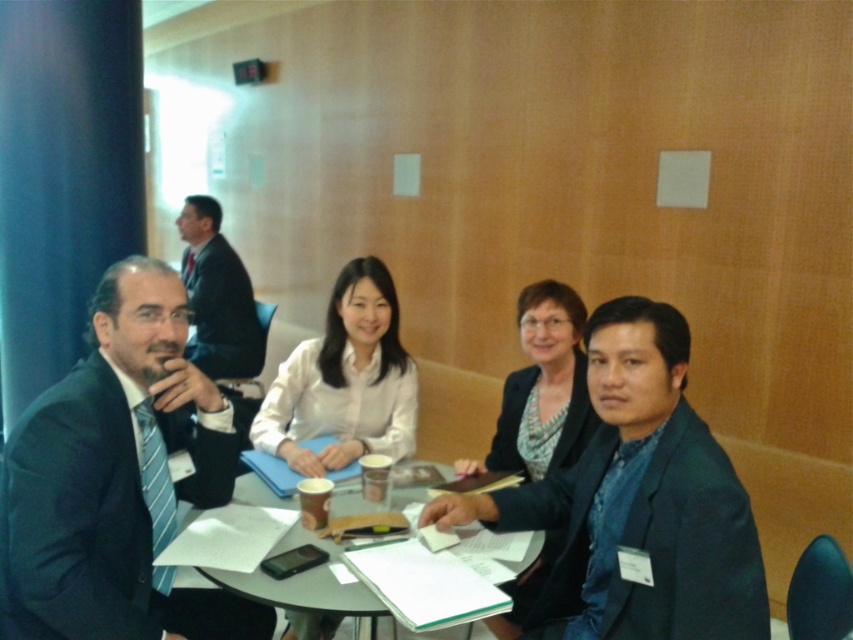
Does white matte shirt at center appear on the right side of matte black blazer at center?

No, white matte shirt at center is not to the right of matte black blazer at center.

The height and width of the screenshot is (640, 853). In order to click on white matte shirt at center in this screenshot , I will do `click(344, 380)`.

Who is more forward, (302, 396) or (543, 566)?

Point (543, 566) is more forward.

Image resolution: width=853 pixels, height=640 pixels. I want to click on white matte shirt at center, so click(x=344, y=380).

The height and width of the screenshot is (640, 853). In order to click on matte black suit at center in this screenshot , I will do `click(117, 481)`.

Identify the location of matte black suit at center. The width and height of the screenshot is (853, 640). (117, 481).

Is matte black blazer at center further to the viewer compared to dark suit at upper left?

No, it is in front of dark suit at upper left.

Can you confirm if matte black blazer at center is smaller than dark suit at upper left?

Indeed, matte black blazer at center has a smaller size compared to dark suit at upper left.

In order to click on matte black blazer at center in this screenshot , I will do `click(543, 388)`.

This screenshot has height=640, width=853. I want to click on matte black blazer at center, so click(543, 388).